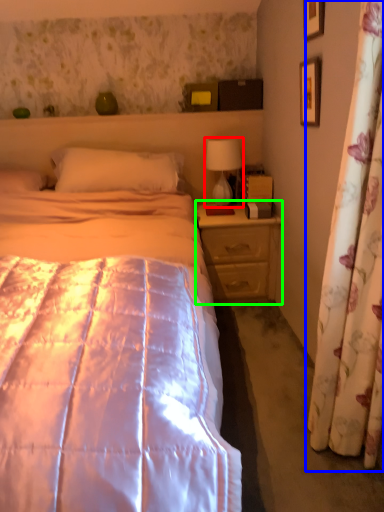
Question: Considering the real-world distances, which object is closest to table lamp (highlighted by a red box)? curtain (highlighted by a blue box) or nightstand (highlighted by a green box).

Choices:
 (A) curtain
 (B) nightstand

Answer: (B)